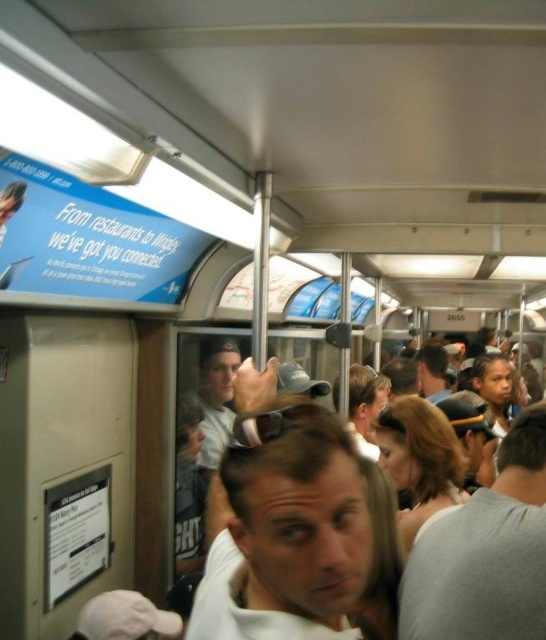
Is point (275, 499) less distant than point (205, 449)?

Yes, it is in front of point (205, 449).

Which is below, white matte shirt at center or light brown leather jacket at center?

Positioned lower is light brown leather jacket at center.

Find the location of a particular element. This screenshot has width=546, height=640. white matte shirt at center is located at coordinates (287, 531).

Find the location of a particular element. The height and width of the screenshot is (640, 546). gray cotton shirt at center is located at coordinates (485, 552).

This screenshot has width=546, height=640. Describe the element at coordinates (485, 552) in the screenshot. I see `gray cotton shirt at center` at that location.

Where is `gray cotton shirt at center`? Image resolution: width=546 pixels, height=640 pixels. gray cotton shirt at center is located at coordinates (485, 552).

Where is `gray cotton shirt at center`? gray cotton shirt at center is located at coordinates (485, 552).

Does white matte shirt at center appear on the right side of matte gray shirt at center?

Incorrect, white matte shirt at center is not on the right side of matte gray shirt at center.

Is white matte shirt at center behind matte gray shirt at center?

That is False.

Looking at this image, who is more distant from viewer, (258,483) or (422,390)?

Positioned behind is point (422,390).

At what (x,y) coordinates should I click in order to perform the action: click on white matte shirt at center. Please return your answer as a coordinate pair (x, y). Image resolution: width=546 pixels, height=640 pixels. Looking at the image, I should click on (287, 531).